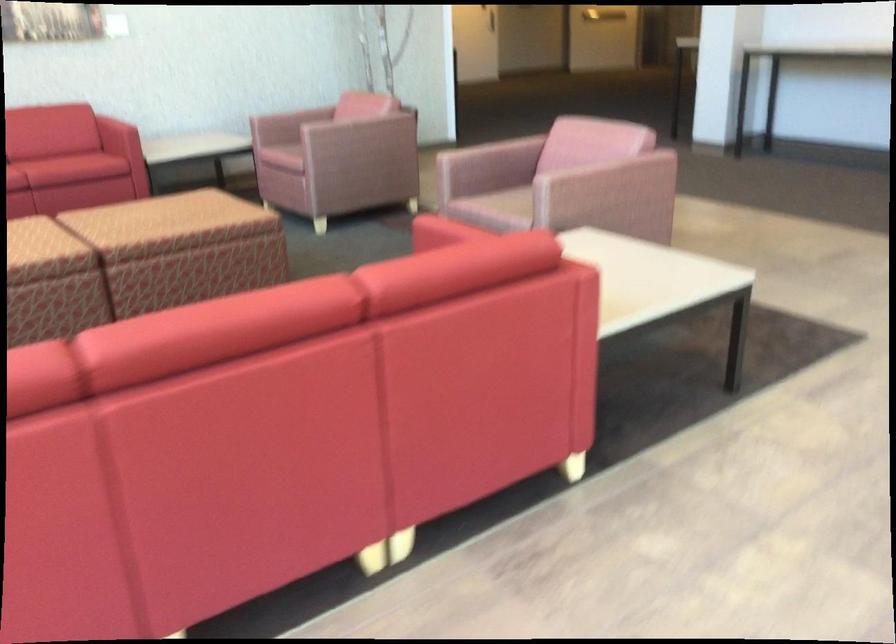
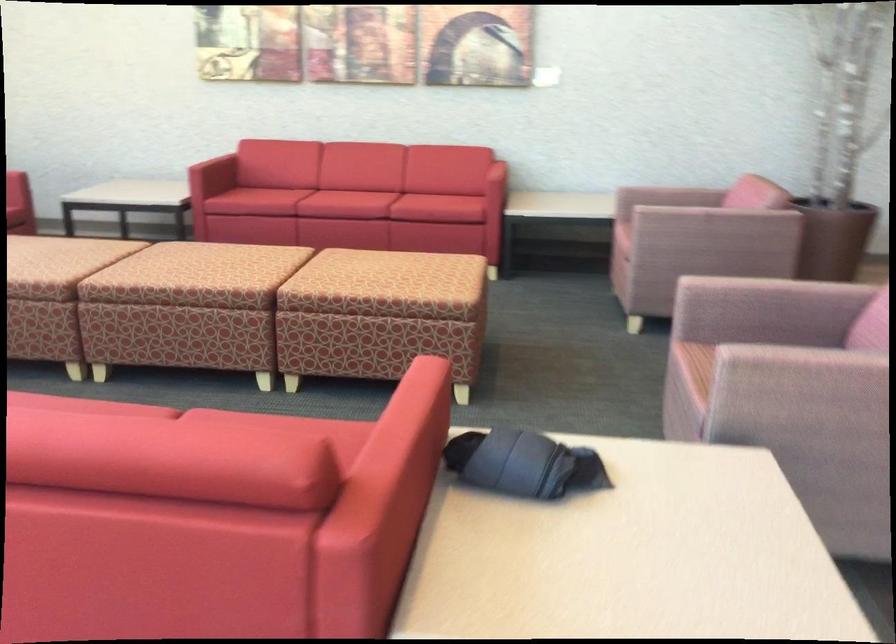
The point at [306,109] is marked in the first image. Where is the corresponding point in the second image?

(669, 196)